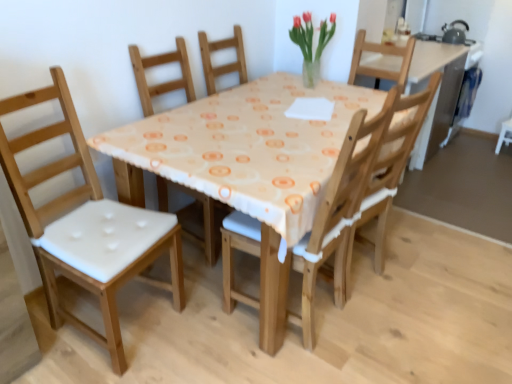
Question: Are translucent glass vase at upper center and wooden chair with white cushion at center, positioned as the 1th chair in right-to-left order, beside each other?

Choices:
 (A) no
 (B) yes

Answer: (A)

Question: Is translucent glass vase at upper center shorter than wooden chair with white cushion at center, arranged as the 2th chair when viewed from the left?

Choices:
 (A) no
 (B) yes

Answer: (B)

Question: Is wooden chair with white cushion at center, arranged as the 2th chair when viewed from the left, a part of translucent glass vase at upper center?

Choices:
 (A) no
 (B) yes

Answer: (A)

Question: Is translucent glass vase at upper center to the left of wooden chair with white cushion at center, positioned as the 1th chair in right-to-left order, from the viewer's perspective?

Choices:
 (A) no
 (B) yes

Answer: (A)

Question: Is translucent glass vase at upper center wider than wooden chair with white cushion at center, arranged as the 2th chair when viewed from the left?

Choices:
 (A) no
 (B) yes

Answer: (A)

Question: From the image's perspective, is translucent glass vase at upper center below wooden chair with white cushion at center, positioned as the 1th chair in right-to-left order?

Choices:
 (A) yes
 (B) no

Answer: (B)

Question: Is wooden chair with white cushion at center, positioned as the 1th chair in right-to-left order, located outside white fabric chair at left, the 1th chair when ordered from left to right?

Choices:
 (A) no
 (B) yes

Answer: (B)

Question: Does wooden chair with white cushion at center, arranged as the 2th chair when viewed from the left, come in front of white fabric chair at left, the 2th chair viewed from the right?

Choices:
 (A) yes
 (B) no

Answer: (B)

Question: Considering the relative positions of wooden chair with white cushion at center, arranged as the 2th chair when viewed from the left, and white fabric chair at left, the 1th chair when ordered from left to right, in the image provided, is wooden chair with white cushion at center, arranged as the 2th chair when viewed from the left, to the right of white fabric chair at left, the 1th chair when ordered from left to right, from the viewer's perspective?

Choices:
 (A) no
 (B) yes

Answer: (B)

Question: From the image's perspective, is wooden chair with white cushion at center, arranged as the 2th chair when viewed from the left, on top of white fabric chair at left, the 2th chair viewed from the right?

Choices:
 (A) no
 (B) yes

Answer: (B)

Question: Is wooden chair with white cushion at center, arranged as the 2th chair when viewed from the left, taller than white fabric chair at left, the 1th chair when ordered from left to right?

Choices:
 (A) no
 (B) yes

Answer: (A)

Question: From a real-world perspective, does wooden chair with white cushion at center, positioned as the 1th chair in right-to-left order, sit lower than white fabric chair at left, the 2th chair viewed from the right?

Choices:
 (A) yes
 (B) no

Answer: (A)

Question: Does white fabric chair at left, the 2th chair viewed from the right, have a lesser width compared to wooden chair with white cushion at center, positioned as the 1th chair in right-to-left order?

Choices:
 (A) yes
 (B) no

Answer: (A)